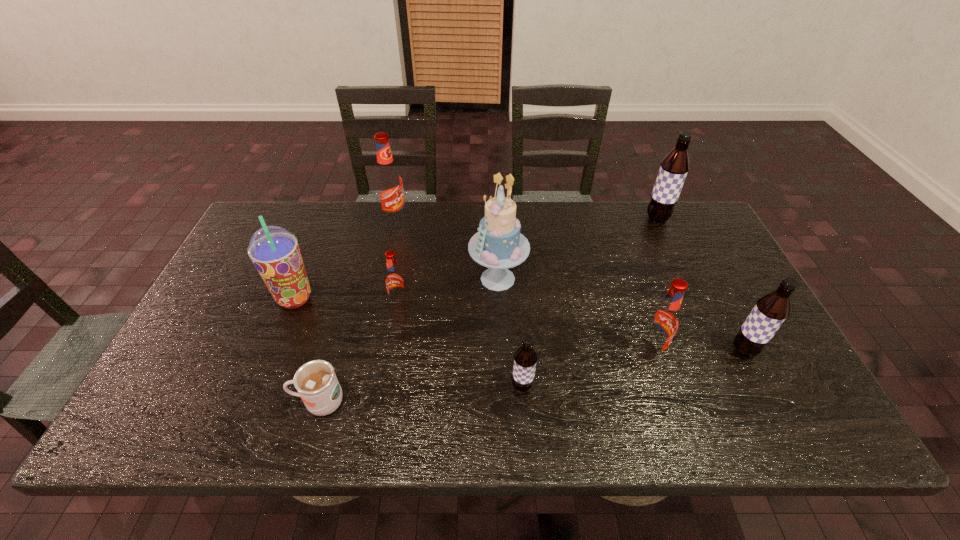
Find the location of `the fourth root beer from right to left`. the fourth root beer from right to left is located at coordinates (525, 358).

What are the coordinates of `cup` in the screenshot? It's located at (316, 382).

Locate an element on the screen. This screenshot has width=960, height=540. vacant area located with a ladder on the side of the blue cake is located at coordinates (392, 279).

Locate an element on the screen. Image resolution: width=960 pixels, height=540 pixels. vacant area located with a ladder on the side of the blue cake is located at coordinates (413, 279).

The height and width of the screenshot is (540, 960). Find the location of `vacant space situated with a ladder on the side of the blue cake`. vacant space situated with a ladder on the side of the blue cake is located at coordinates (343, 279).

Locate an element on the screen. The width and height of the screenshot is (960, 540). vacant space positioned on the right of the biggest brown root beer is located at coordinates (688, 219).

I want to click on free region located 0.100m on the left of the biggest red root beer, so click(x=352, y=219).

Locate an element on the screen. free region located on the back of the smoothie is located at coordinates (306, 271).

This screenshot has width=960, height=540. Find the location of `vacant space located 0.260m on the left of the nearest red root beer`. vacant space located 0.260m on the left of the nearest red root beer is located at coordinates (530, 352).

Image resolution: width=960 pixels, height=540 pixels. Find the location of `vacant space located 0.070m on the front of the second biggest brown root beer`. vacant space located 0.070m on the front of the second biggest brown root beer is located at coordinates (763, 388).